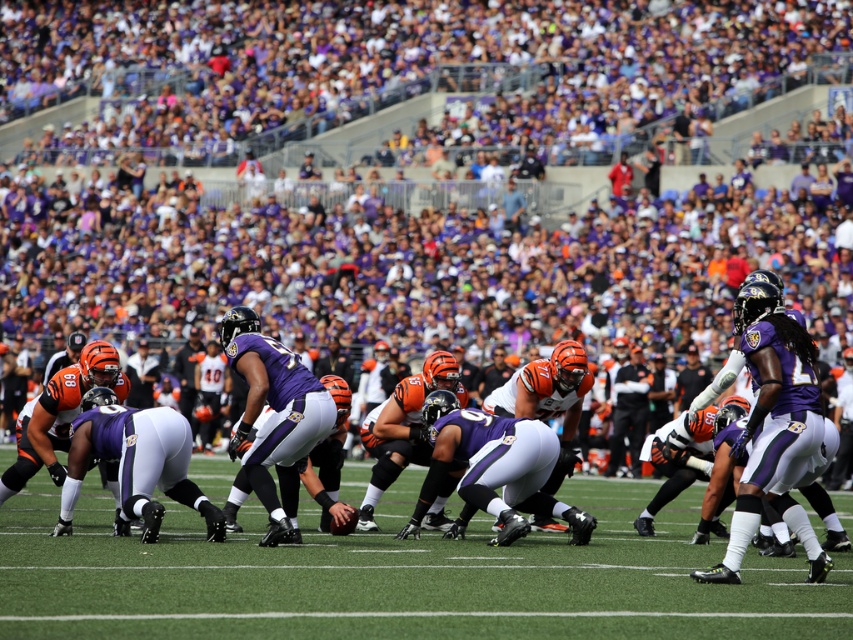
The width and height of the screenshot is (853, 640). Describe the element at coordinates (503, 426) in the screenshot. I see `purple matte jersey at center` at that location.

Does point (820, 426) lie behind point (454, 561)?

That is False.

Where is `purple matte jersey at center`? purple matte jersey at center is located at coordinates (503, 426).